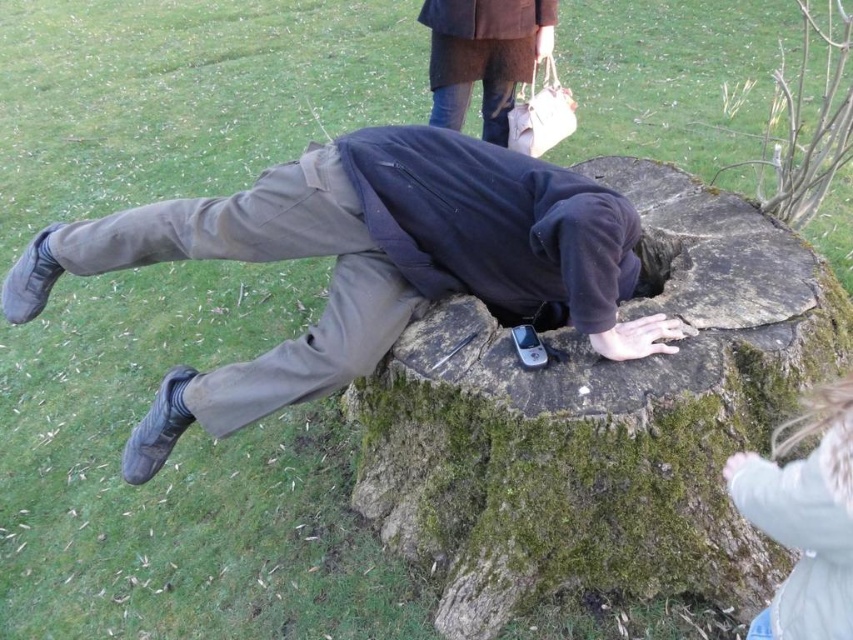
Question: Which object is positioned farthest from the light blue fleece jacket at lower right?

Choices:
 (A) dark blue fleece at center
 (B) mossy bark stump at center

Answer: (A)

Question: Based on their relative distances, which object is farther from the mossy bark stump at center?

Choices:
 (A) light blue fleece jacket at lower right
 (B) dark blue fleece at center

Answer: (A)

Question: Is mossy bark stump at center wider than light blue fleece jacket at lower right?

Choices:
 (A) yes
 (B) no

Answer: (A)

Question: Can you confirm if dark blue fleece at center is thinner than light blue fleece jacket at lower right?

Choices:
 (A) no
 (B) yes

Answer: (A)

Question: Can you confirm if mossy bark stump at center is thinner than dark blue fleece at center?

Choices:
 (A) yes
 (B) no

Answer: (A)

Question: Among these objects, which one is nearest to the camera?

Choices:
 (A) dark blue fleece at center
 (B) mossy bark stump at center
 (C) light blue fleece jacket at lower right

Answer: (C)